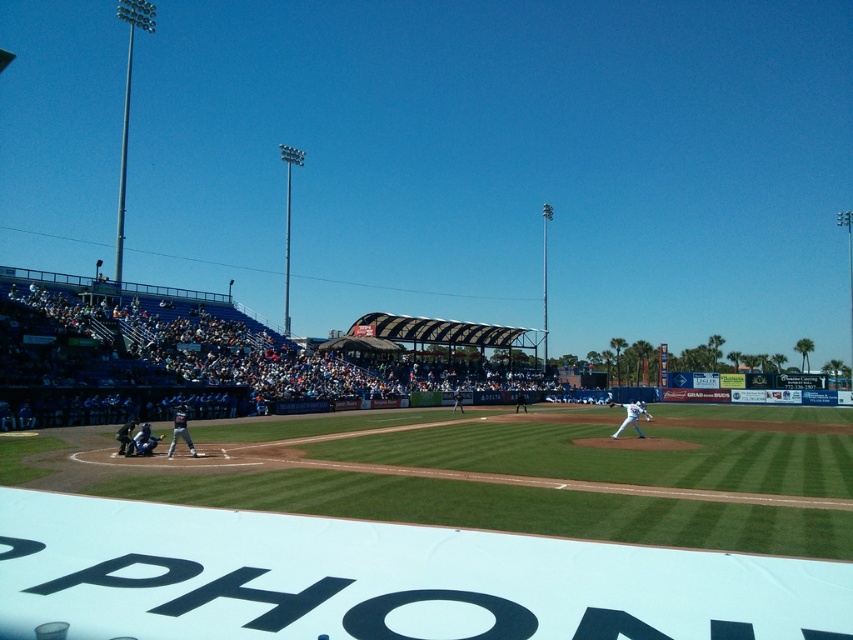
Question: Considering the relative positions of white matte baseball bat at center and brown leather glove at lower left in the image provided, where is white matte baseball bat at center located with respect to brown leather glove at lower left?

Choices:
 (A) above
 (B) below

Answer: (B)

Question: Which of the following is the farthest from the observer?

Choices:
 (A) white matte baseball bat at center
 (B) green grass field at center
 (C) matte gray bat at lower left

Answer: (A)

Question: Which of the following is the farthest from the observer?

Choices:
 (A) brown leather glove at center
 (B) green grass field at center
 (C) brown leather glove at lower left

Answer: (A)

Question: Which point is farther to the camera?

Choices:
 (A) white matte baseball bat at center
 (B) blue jersey baseball team at left

Answer: (B)

Question: Is green grass field at center further to the viewer compared to white matte baseball bat at center?

Choices:
 (A) no
 (B) yes

Answer: (A)

Question: Is green grass field at center to the left of matte gray bat at lower left from the viewer's perspective?

Choices:
 (A) yes
 (B) no

Answer: (B)